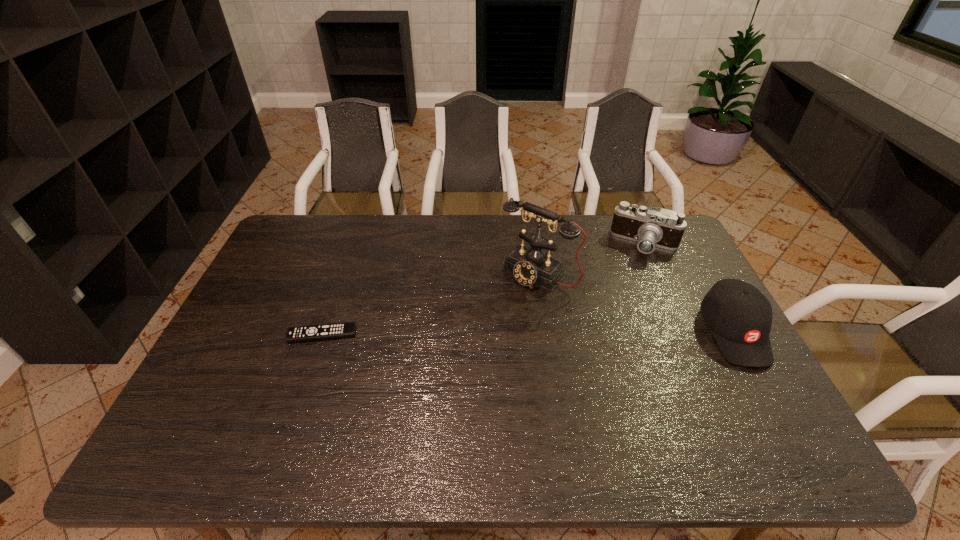
This screenshot has height=540, width=960. Identify the location of vacant space at the left edge of the desktop. (299, 292).

In the image, there is a desktop. At what (x,y) coordinates should I click in order to perform the action: click on vacant space at the right edge. Please return your answer as a coordinate pair (x, y). The image size is (960, 540). Looking at the image, I should click on (756, 379).

You are a GUI agent. You are given a task and a screenshot of the screen. Output one action in this format:
    pyautogui.click(x=<x>, y=<y>)
    Task: Click on the blank area at the far left corner
    The height and width of the screenshot is (540, 960).
    Given the screenshot: What is the action you would take?
    pyautogui.click(x=304, y=247)

You are a GUI agent. You are given a task and a screenshot of the screen. Output one action in this format:
    pyautogui.click(x=<x>, y=<y>)
    Task: Click on the vacant space in between the camera and the baseball cap
    This screenshot has width=960, height=540.
    Given the screenshot: What is the action you would take?
    pyautogui.click(x=689, y=288)

This screenshot has height=540, width=960. What are the coordinates of `vacant area between the camera and the baseball cap` in the screenshot? It's located at (689, 288).

Where is `vacant space that is in between the baseball cap and the camera`? vacant space that is in between the baseball cap and the camera is located at coordinates click(689, 288).

Identify the location of vacant point located between the camera and the telephone. (591, 259).

Locate an element on the screen. The height and width of the screenshot is (540, 960). blank region between the camera and the baseball cap is located at coordinates (689, 288).

At what (x,y) coordinates should I click in order to perform the action: click on free point between the baseball cap and the telephone. Please return your answer as a coordinate pair (x, y). The image size is (960, 540). Looking at the image, I should click on (636, 303).

The width and height of the screenshot is (960, 540). Find the location of `empty space between the baseball cap and the telephone`. empty space between the baseball cap and the telephone is located at coordinates (636, 303).